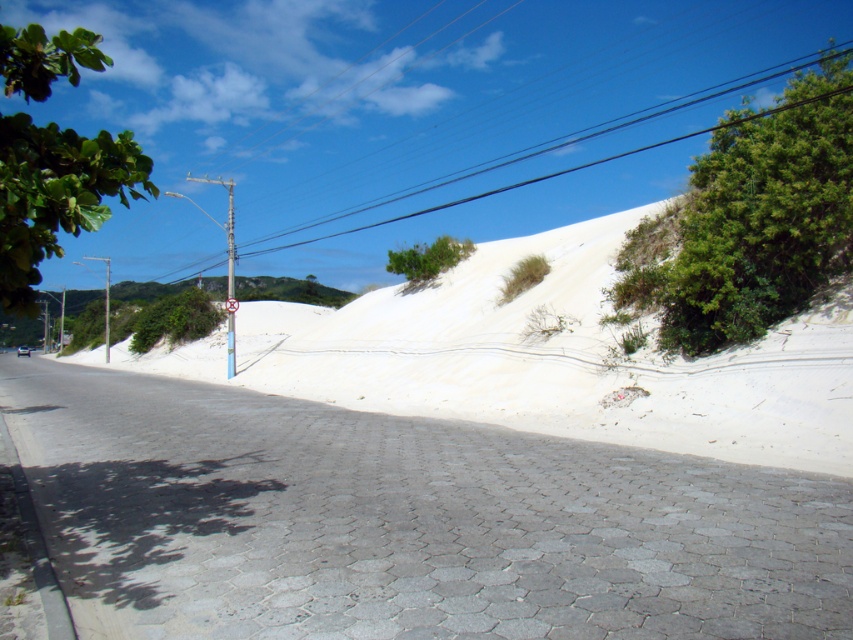
Between green leafy bush at upper center and blue painted metal pole at center, which one is positioned lower?

blue painted metal pole at center is lower down.

At what (x,y) coordinates should I click in order to perform the action: click on green leafy bush at upper center. Please return your answer as a coordinate pair (x, y). Looking at the image, I should click on (427, 257).

Between point (422, 244) and point (228, 243), which one is positioned in front?

Positioned in front is point (228, 243).

You are a GUI agent. You are given a task and a screenshot of the screen. Output one action in this format:
    pyautogui.click(x=<x>, y=<y>)
    Task: Click on the green leafy bush at upper center
    
    Given the screenshot: What is the action you would take?
    click(427, 257)

Is point (549, 403) positioned after point (144, 349)?

No, it is not.

Can you confirm if white sand dune at center is taller than green leafy bush at center?

Indeed, white sand dune at center has a greater height compared to green leafy bush at center.

Is point (732, 381) in front of point (192, 301)?

Yes, it is in front of point (192, 301).

Locate an element on the screen. white sand dune at center is located at coordinates (544, 360).

Is green leafy bush at upper center closer to camera compared to white plastic sign at upper center?

No, green leafy bush at upper center is behind white plastic sign at upper center.

Does green leafy bush at upper center appear under white plastic sign at upper center?

No, green leafy bush at upper center is not below white plastic sign at upper center.

This screenshot has height=640, width=853. I want to click on green leafy bush at upper center, so click(x=427, y=257).

This screenshot has width=853, height=640. What are the coordinates of `green leafy bush at upper center` in the screenshot? It's located at [427, 257].